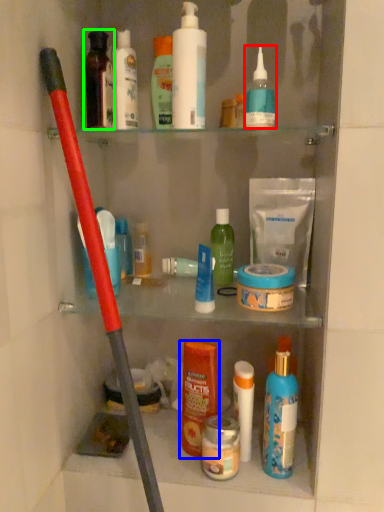
Question: Which object is the farthest from toiletry (highlighted by a red box)? Choose among these: toiletry (highlighted by a blue box) or toiletry (highlighted by a green box).

Choices:
 (A) toiletry
 (B) toiletry

Answer: (A)